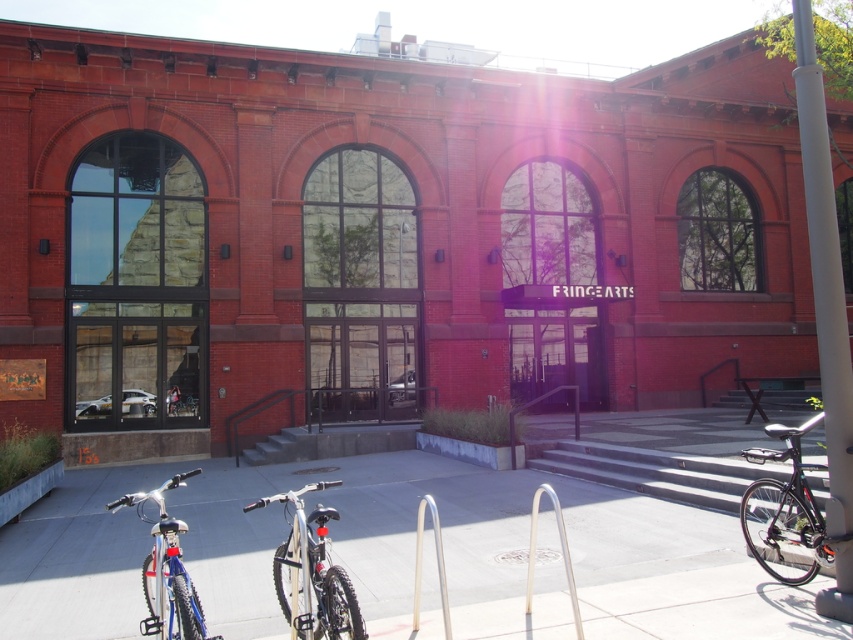
Looking at this image, you are a delivery person trying to park your shiny silver bicycle at center near the smooth concrete pavement at center. Can you safely place your bicycle on the pavement?

The smooth concrete pavement at center is positioned under shiny silver bicycle at center, so yes, you can safely place your bicycle on the pavement.

Consider the image. You are a delivery person trying to park your bike near the FRINGE ARTS building. You see the shiny blue bike at lower left and the matte black bicycle at lower left. Which bike is closer to the entrance of the building?

The shiny blue bike at lower left is closer to the entrance because it is in front of the matte black bicycle at lower left, which is further away.

You are a cyclist who just arrived at the FRINGE ARTS building. You see a shiny silver bicycle at center and a silver metallic bike rack at center. Which bicycle is closer to the entrance of the building?

The shiny silver bicycle at center is positioned on the left side of the silver metallic bike rack at center, so the bicycle is closer to the entrance than the bike rack.